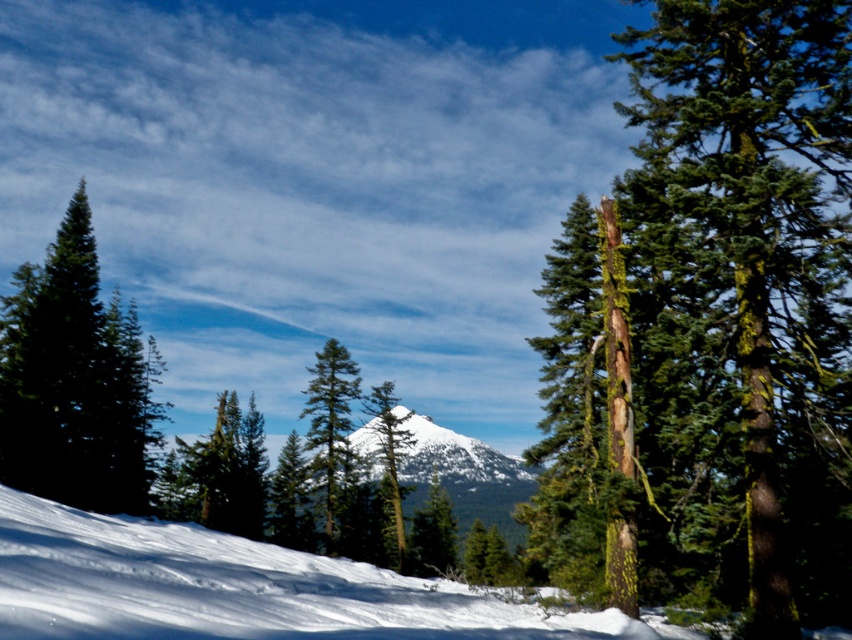
You are an observer standing at the bottom of the snow hill. Looking at the green matte tree at center and the green mossy tree at center, which one appears higher in the scene?

The green matte tree at center is located above the green mossy tree at center, so it appears higher in the scene.

You are an observer standing at the bottom of the hill. You notice the white snow at lower left and the green mossy tree at center. Which object is taller from your viewpoint?

The green mossy tree at center is taller than the white snow at lower left.

Looking at this image, you are an animal trying to cross from the white snow at lower left to the green mossy tree at center. Given that your maximum jumping distance is 35 meters, can you safely make the leap?

The distance between the white snow at lower left and the green mossy tree at center is 37.60 meters, which exceeds your maximum jumping distance of 35 meters. Therefore, you cannot safely make the leap.